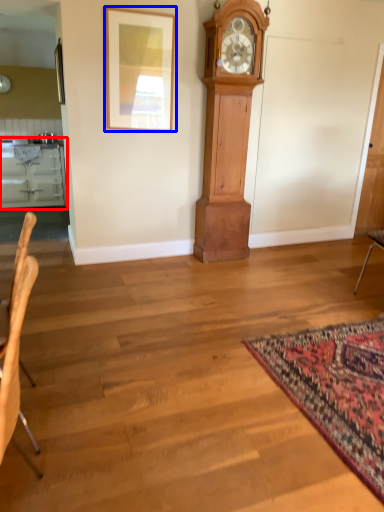
Question: Which object appears closest to the camera in this image, cabinetry (highlighted by a red box) or picture frame (highlighted by a blue box)?

Choices:
 (A) cabinetry
 (B) picture frame

Answer: (B)